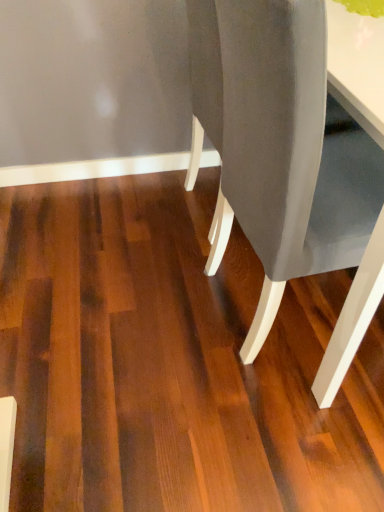
Question: From the image's perspective, relative to matte gray chair at center, is dark brown wood floor at center above or below?

Choices:
 (A) below
 (B) above

Answer: (A)

Question: Considering the positions of dark brown wood floor at center and matte gray chair at center in the image, is dark brown wood floor at center wider or thinner than matte gray chair at center?

Choices:
 (A) wide
 (B) thin

Answer: (A)

Question: Considering their positions, is dark brown wood floor at center located in front of or behind matte gray chair at center?

Choices:
 (A) behind
 (B) front

Answer: (A)

Question: Is matte gray chair at center situated inside dark brown wood floor at center or outside?

Choices:
 (A) inside
 (B) outside

Answer: (B)

Question: From their relative heights in the image, would you say matte gray chair at center is taller or shorter than dark brown wood floor at center?

Choices:
 (A) tall
 (B) short

Answer: (A)

Question: Considering the relative positions of matte gray chair at center and dark brown wood floor at center in the image provided, is matte gray chair at center to the left or to the right of dark brown wood floor at center?

Choices:
 (A) left
 (B) right

Answer: (B)

Question: From the image's perspective, is matte gray chair at center above or below dark brown wood floor at center?

Choices:
 (A) below
 (B) above

Answer: (B)